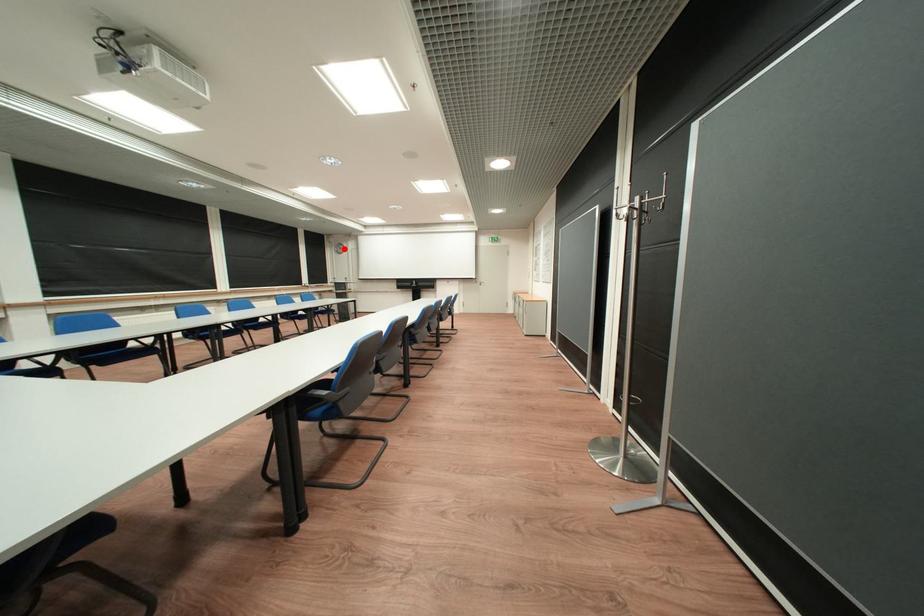
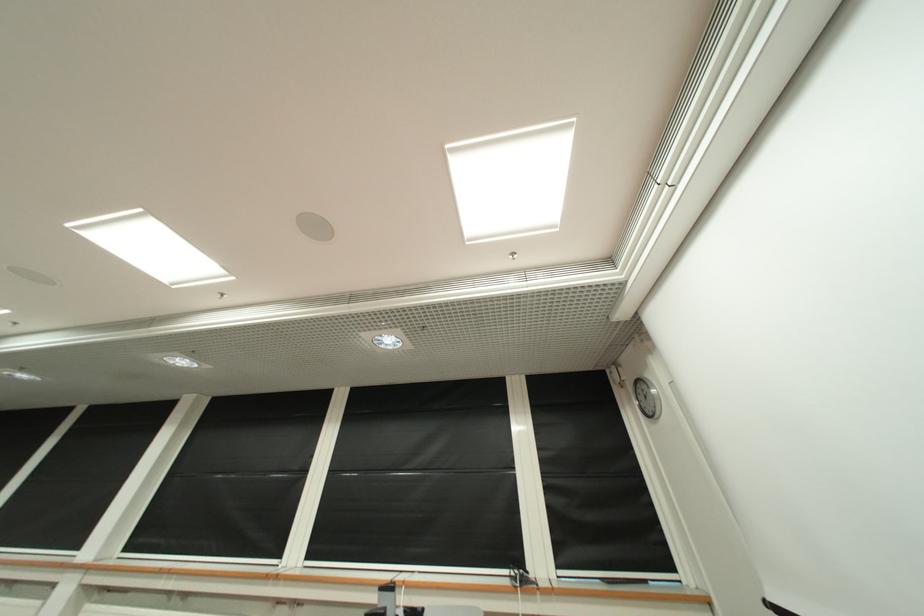
Question: I am providing you with two images of the same scene from different viewpoints. A red point is shown in image1. For the corresponding object point in image2, is it positioned nearer or farther from the camera?

Choices:
 (A) Nearer
 (B) Farther

Answer: (B)